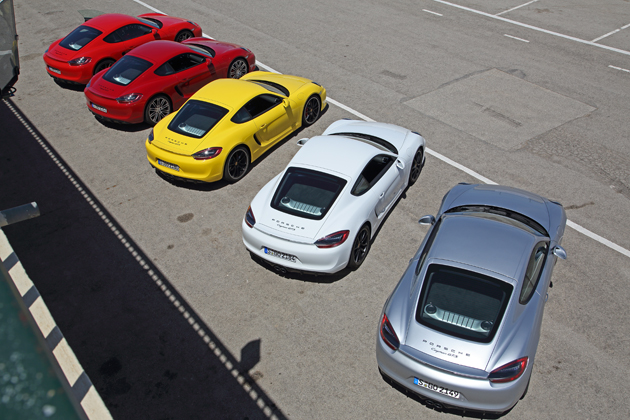
Find the location of a particular element. back windows is located at coordinates [x=466, y=305], [x=306, y=187], [x=188, y=123], [x=122, y=72], [x=72, y=38].